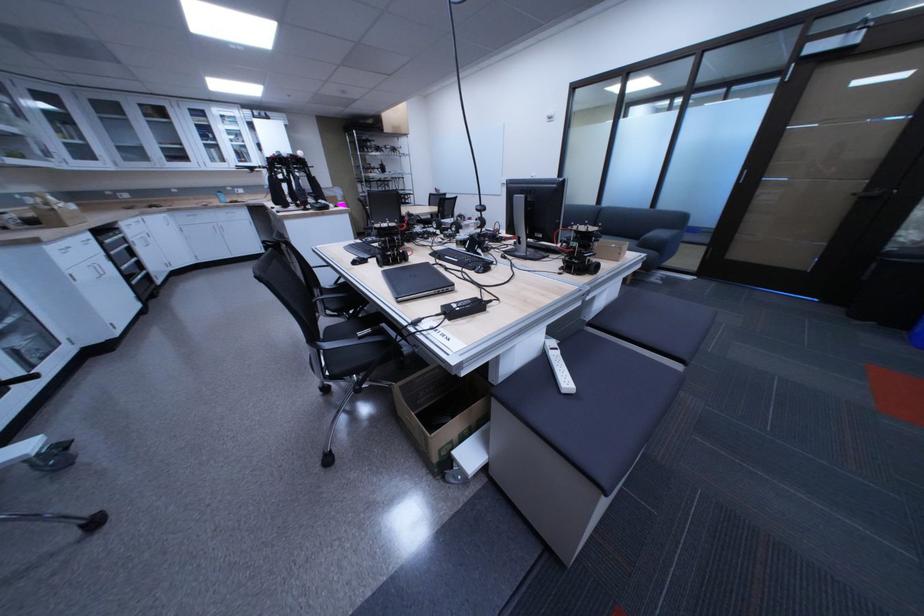
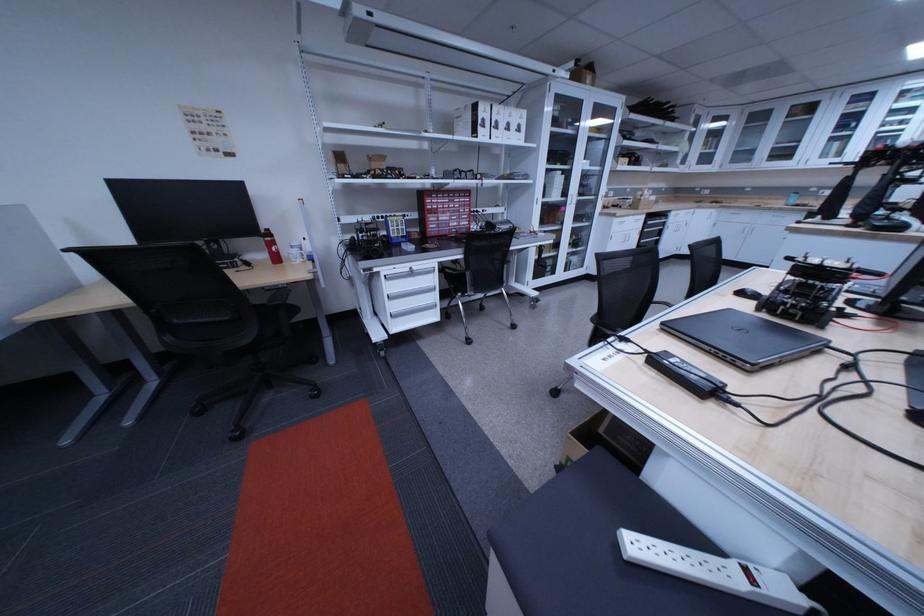
Locate, in the second image, the point that corresponds to [334,488] in the first image.

(553, 395)